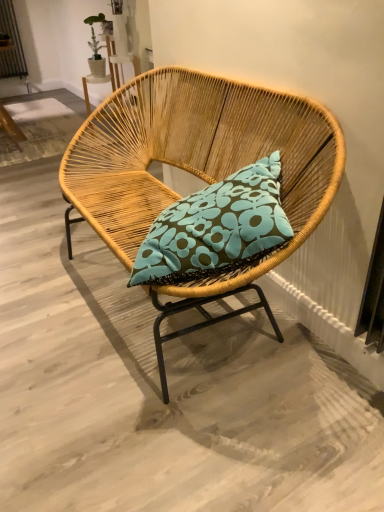
This screenshot has width=384, height=512. I want to click on vacant space to the left of woven wood chair at center, so 38,290.